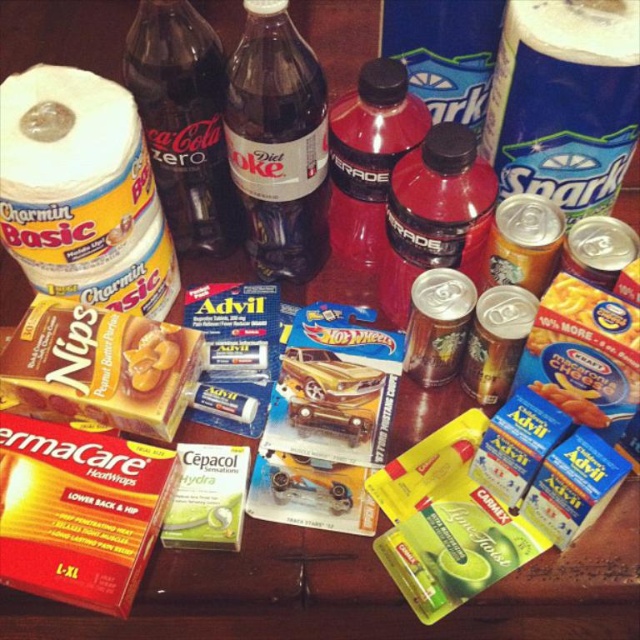
Is metallic silver soda at center smaller than pink matte gatorade at center?

Yes.

Between metallic silver soda at center and pink matte gatorade at center, which one has less height?

metallic silver soda at center is shorter.

Locate an element on the screen. The image size is (640, 640). metallic silver soda at center is located at coordinates (435, 212).

The height and width of the screenshot is (640, 640). I want to click on metallic silver soda at center, so click(435, 212).

Is point (234, 125) less distant than point (369, 161)?

Yes, it is.

Does diet coke bottle at upper center have a greater width compared to pink matte gatorade at center?

No, diet coke bottle at upper center is not wider than pink matte gatorade at center.

Does point (320, 81) lie in front of point (378, 156)?

Yes.

Locate an element on the screen. The width and height of the screenshot is (640, 640). diet coke bottle at upper center is located at coordinates (276, 141).

Which is behind, point (616, 83) or point (202, 122)?

Point (202, 122)

Can you confirm if clear plastic bottle at upper right is thinner than dark glass bottle at center?

In fact, clear plastic bottle at upper right might be wider than dark glass bottle at center.

Is point (554, 99) closer to camera compared to point (189, 81)?

Yes, it is in front of point (189, 81).

Find the location of a particular element. This screenshot has height=640, width=640. clear plastic bottle at upper right is located at coordinates (564, 100).